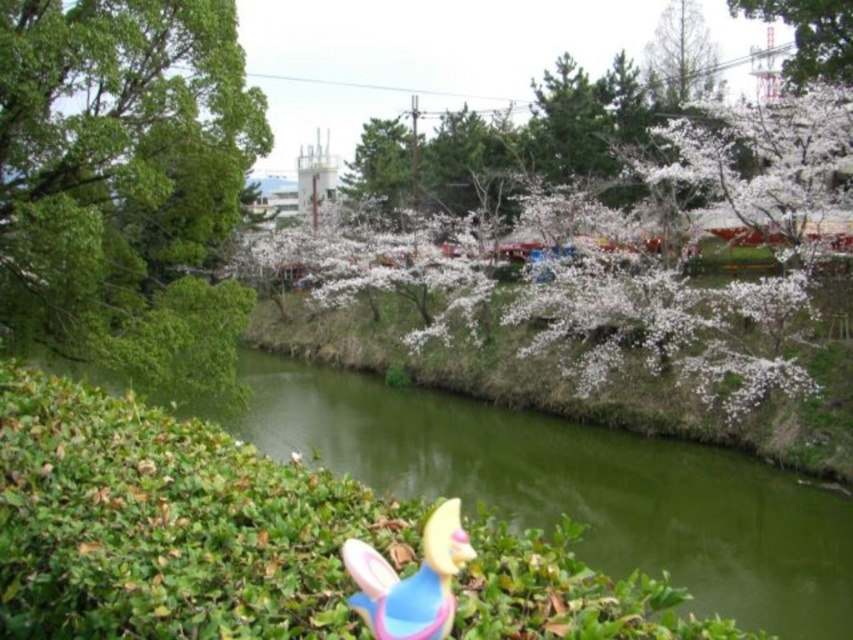
You are a photographer standing at the edge of the pond. You want to take a photo of the green smooth water at center and the pastel plastic bunny at lower center. Which object is closer to your camera lens?

The pastel plastic bunny at lower center is closer to the camera lens because the green smooth water at center is further away from the viewer.

You are a child playing in the outdoor scene described. You want to find the pastel plastic bunny at lower center. Which direction should you look relative to the green leafy tree at left?

The pastel plastic bunny at lower center is to the right of the green leafy tree at left, so you should look to the right side of the tree.

You are standing in the serene outdoor scene with the small body of water surrounded by lush greenery and cherry blossoms. You see two points marked in the image, one at coordinates point (201, 436) and the other at point (433, 612). Which point is closer to your current position?

Point (201, 436) is closer to your current position because it is further to the camera than point (433, 612).